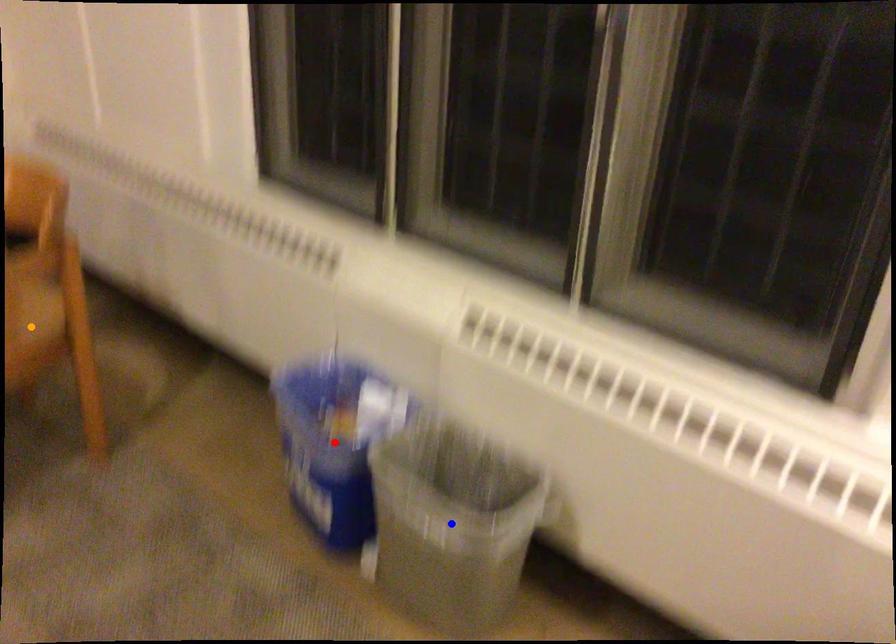
Order these from nearest to farthest:
red point | blue point | orange point

blue point → red point → orange point